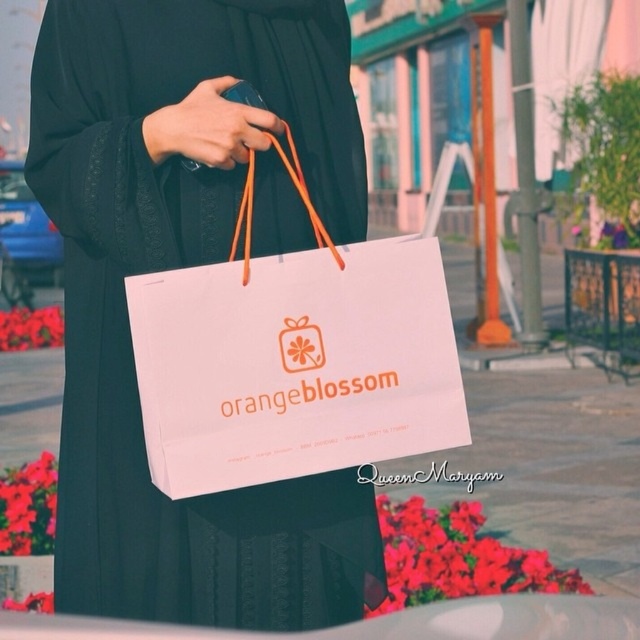
You are a delivery person who needs to hand over a package to the person in the image. The package is too large to fit in your hands, so you must place it on the ground. Where should you place it so that it is closest to both the black matte robe at center and the white paper bag at center?

Place the package between the black matte robe at center and the white paper bag at center since the black matte robe at center is on the left side of the white paper bag at center, so placing it in between them ensures it is closest to both objects.

You are a fashion designer observing the scene. You need to determine which object is taller between the black matte robe at center and the white paper bag at center. Based on the scene description, which one is taller?

The black matte robe at center is taller than the white paper bag at center according to the description.